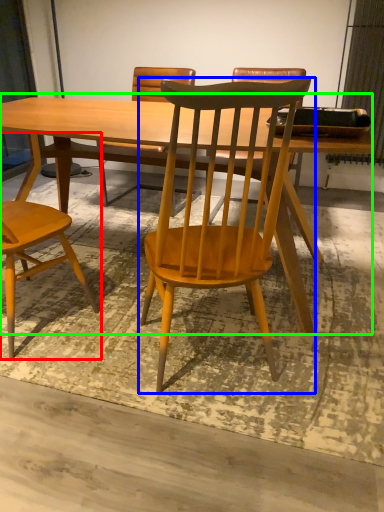
Question: Based on their relative distances, which object is farther from chair (highlighted by a red box)? Choose from chair (highlighted by a blue box) and table (highlighted by a green box).

Choices:
 (A) chair
 (B) table

Answer: (A)